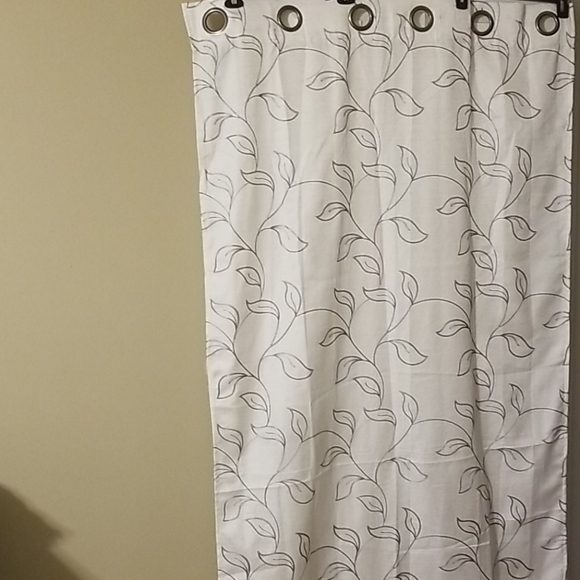
Point to any where a shower rod would go through in the image. Your answer should be formatted as a list of tuples, i.e. [(x1, y1), (x2, y2), ...], where each tuple contains the x and y coordinates of a point satisfying the conditions above.

[(218, 24), (289, 18), (367, 18), (418, 18), (481, 24), (551, 20)]